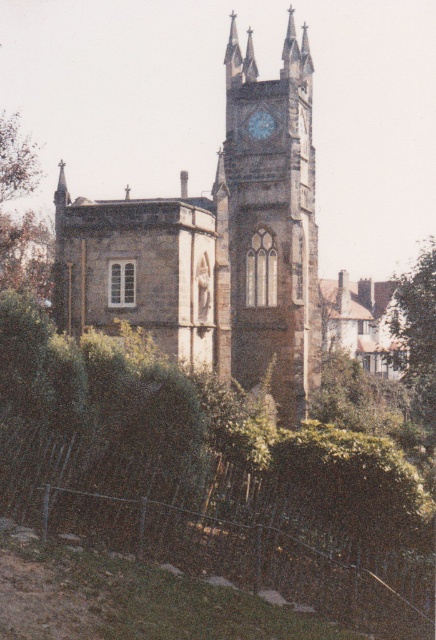
Question: Estimate the real-world distances between objects in this image. Which object is closer to the stone clock tower at center?

Choices:
 (A) metallic clock face at upper center
 (B) brown stone clock tower at center

Answer: (B)

Question: Considering the real-world distances, which object is closest to the green leafy tree at upper right?

Choices:
 (A) metallic clock face at upper center
 (B) brown stone clock tower at center
 (C) stone clock tower at center

Answer: (B)

Question: Among these points, which one is farthest from the camera?

Choices:
 (A) (251, 120)
 (B) (115, 317)
 (C) (405, 317)
 (D) (261, 232)

Answer: (C)

Question: Is the position of stone clock tower at center more distant than that of green leafy tree at upper right?

Choices:
 (A) no
 (B) yes

Answer: (A)

Question: Can you confirm if brown stone clock tower at center is wider than metallic clock face at upper center?

Choices:
 (A) no
 (B) yes

Answer: (B)

Question: Can you confirm if stone clock tower at center is positioned above metallic clock face at upper center?

Choices:
 (A) no
 (B) yes

Answer: (A)